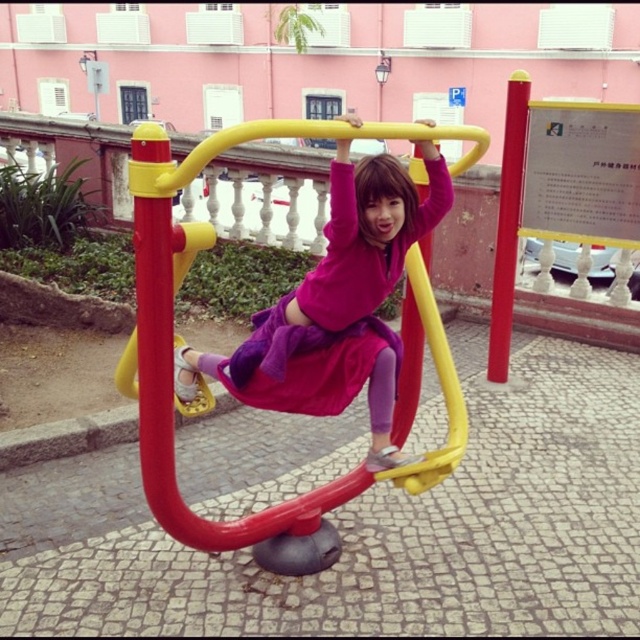
You are designing a playground safety inspection report and need to compare the dimensions of the equipment. Which object has a greater width between the matte plastic swing at center and the red plastic pole at center?

The matte plastic swing at center has a greater width than the red plastic pole at center according to the description provided.